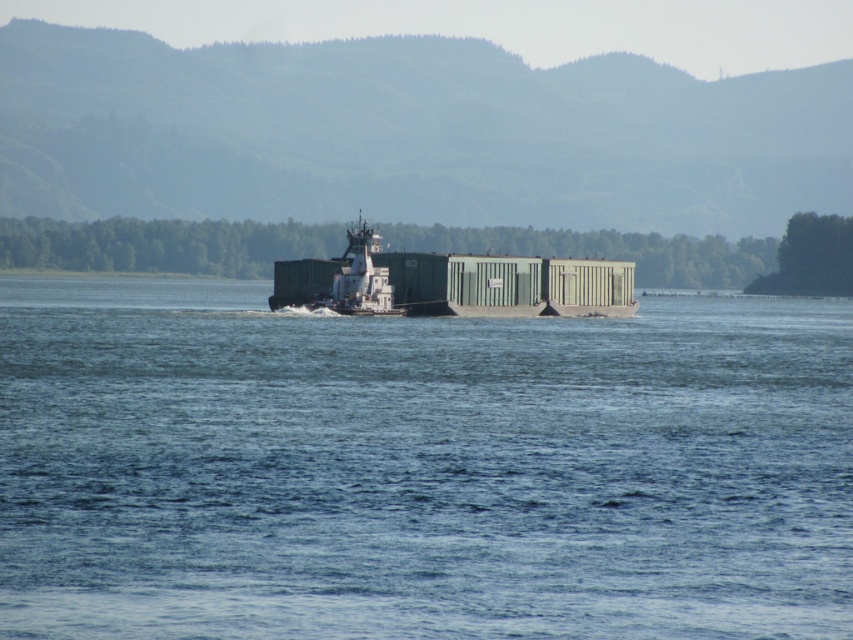
In the scene shown: Between blue water at center and green matte container ship at center, which one appears on the right side from the viewer's perspective?

blue water at center is more to the right.

Which is behind, point (106, 284) or point (624, 289)?

The point (106, 284) is more distant.

Find the location of a particular element. The height and width of the screenshot is (640, 853). blue water at center is located at coordinates (418, 467).